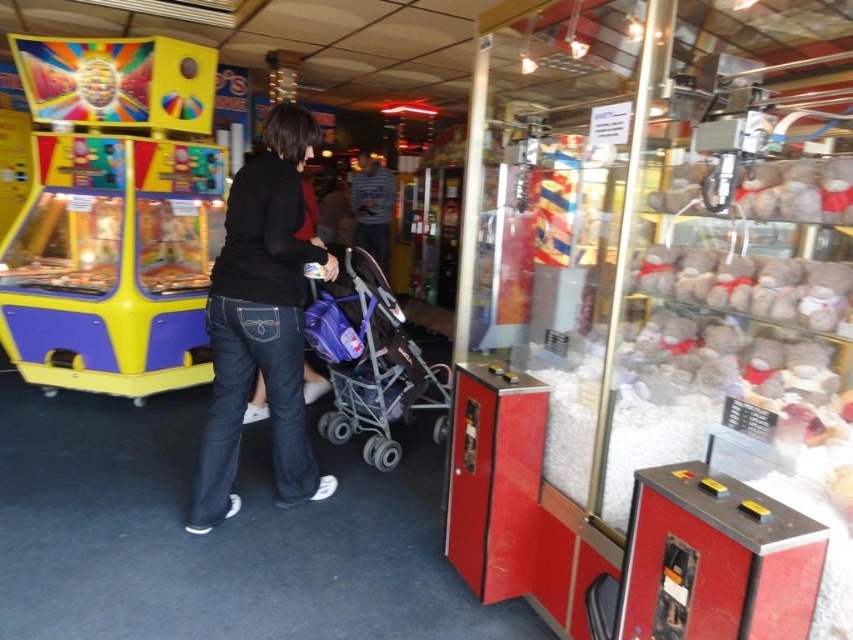
I want to click on shiny plastic claw machine at left, so click(x=113, y=218).

Is shiny plastic claw machine at left bigger than purple fabric baby carriage at center?

Yes, shiny plastic claw machine at left is bigger than purple fabric baby carriage at center.

Between point (169, 312) and point (343, 394), which one is positioned behind?

Positioned behind is point (169, 312).

The height and width of the screenshot is (640, 853). Find the location of `shiny plastic claw machine at left`. shiny plastic claw machine at left is located at coordinates (113, 218).

Is purple fabric baby carriage at center further to camera compared to striped shirt at center?

That is False.

Is point (415, 355) less distant than point (363, 209)?

Yes.

The height and width of the screenshot is (640, 853). In order to click on purple fabric baby carriage at center in this screenshot , I will do `click(378, 368)`.

Consider the image. Can you confirm if black denim jeans at center is taller than striped shirt at center?

Yes, black denim jeans at center is taller than striped shirt at center.

Describe the element at coordinates (260, 321) in the screenshot. The image size is (853, 640). I see `black denim jeans at center` at that location.

Identify the location of black denim jeans at center. This screenshot has height=640, width=853. (260, 321).